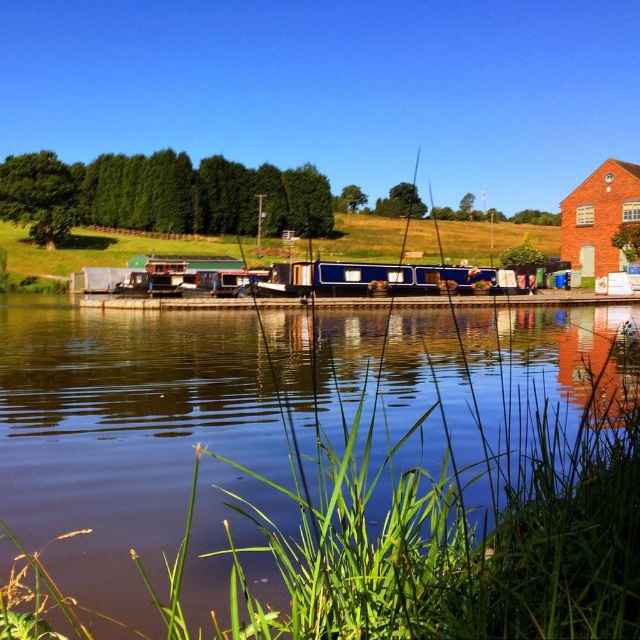
Question: Where is blue glossy water at center located in relation to blue polished wood barge at center in the image?

Choices:
 (A) above
 (B) below

Answer: (B)

Question: Which point is closer to the camera taking this photo?

Choices:
 (A) (266, 472)
 (B) (360, 273)

Answer: (A)

Question: Among these points, which one is nearest to the camera?

Choices:
 (A) (296, 282)
 (B) (129, 458)

Answer: (B)

Question: Among these objects, which one is nearest to the camera?

Choices:
 (A) blue polished wood barge at center
 (B) blue glossy water at center

Answer: (B)

Question: Can you confirm if blue glossy water at center is positioned to the left of blue polished wood barge at center?

Choices:
 (A) yes
 (B) no

Answer: (A)

Question: Is the position of blue glossy water at center less distant than that of blue polished wood barge at center?

Choices:
 (A) no
 (B) yes

Answer: (B)